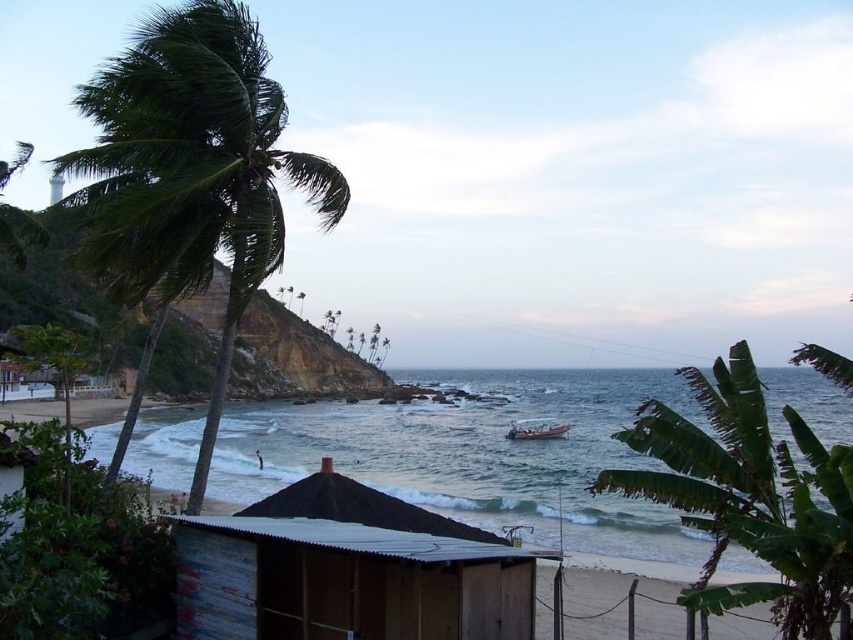
Between point (276, 604) and point (524, 435), which one is positioned in front?

Point (276, 604) is in front.

Is rusty corrugated metal hut at center above metallic silver boat at center?

Yes.

Locate an element on the screen. rusty corrugated metal hut at center is located at coordinates (346, 572).

Identify the location of rusty corrugated metal hut at center. (346, 572).

Can you confirm if clear blue water at center is positioned above rusty corrugated metal hut at center?

Actually, clear blue water at center is below rusty corrugated metal hut at center.

Does clear blue water at center appear on the right side of rusty corrugated metal hut at center?

Correct, you'll find clear blue water at center to the right of rusty corrugated metal hut at center.

The width and height of the screenshot is (853, 640). I want to click on clear blue water at center, so click(479, 456).

Does green leafy palm tree at left have a smaller size compared to metallic silver boat at center?

No.

Does green leafy palm tree at left have a lesser width compared to metallic silver boat at center?

No, green leafy palm tree at left is not thinner than metallic silver boat at center.

What do you see at coordinates (192, 170) in the screenshot?
I see `green leafy palm tree at left` at bounding box center [192, 170].

Image resolution: width=853 pixels, height=640 pixels. In order to click on green leafy palm tree at left in this screenshot , I will do `click(192, 170)`.